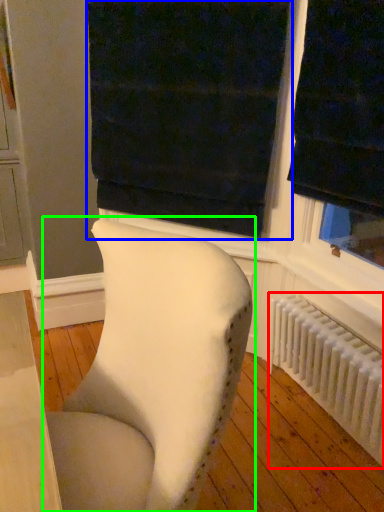
Question: Considering the real-world distances, which object is closest to radiator (highlighted by a red box)? curtain (highlighted by a blue box) or chair (highlighted by a green box).

Choices:
 (A) curtain
 (B) chair

Answer: (A)